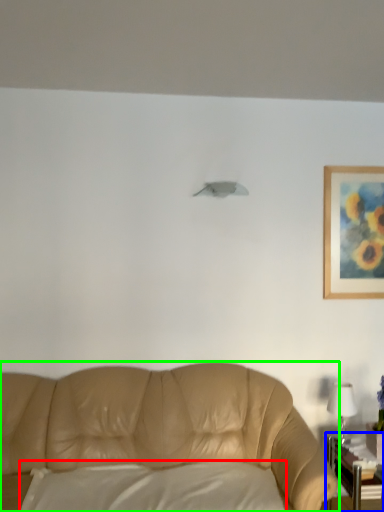
Question: Estimate the real-world distances between objects in this image. Which object is farther from pillow (highlighted by a red box), table (highlighted by a blue box) or studio couch (highlighted by a green box)?

Choices:
 (A) table
 (B) studio couch

Answer: (A)